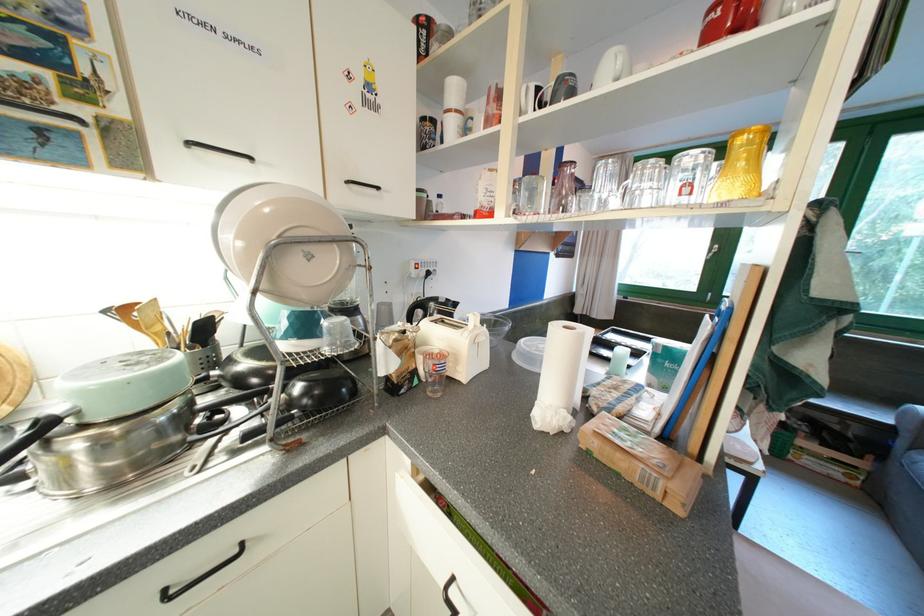
Find where to grasp the pan handle. Please return your answer as a coordinate pair (x, y).

(35, 431)